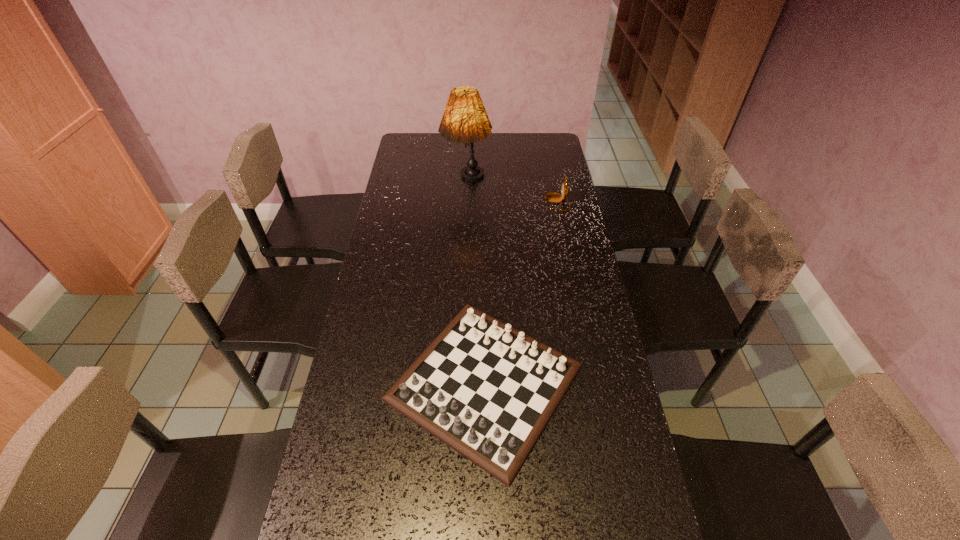
The height and width of the screenshot is (540, 960). I want to click on pocket watch that is at the right edge, so (x=550, y=197).

You are a GUI agent. You are given a task and a screenshot of the screen. Output one action in this format:
    pyautogui.click(x=<x>, y=<y>)
    Task: Click on the chessboard that is at the right edge
    
    Given the screenshot: What is the action you would take?
    pyautogui.click(x=487, y=390)

Find the location of a particular element. Image resolution: width=960 pixels, height=540 pixels. free space at the left edge of the desktop is located at coordinates (348, 492).

I want to click on vacant space at the right edge of the desktop, so click(576, 280).

In the image, there is a desktop. In order to click on vacant space at the far left corner in this screenshot , I will do `click(420, 159)`.

Where is `unoccupied area between the nearest object and the second shortest object`? unoccupied area between the nearest object and the second shortest object is located at coordinates (521, 292).

The image size is (960, 540). Identify the location of vacant area between the second shortest object and the tallest object. (512, 193).

Find the location of a particular element. This screenshot has width=960, height=540. free space between the pocket watch and the tallest object is located at coordinates (512, 193).

The width and height of the screenshot is (960, 540). Find the location of `empty space between the chessboard and the lampshade`. empty space between the chessboard and the lampshade is located at coordinates (476, 283).

In order to click on free space between the pocket watch and the tallest object in this screenshot , I will do click(x=512, y=193).